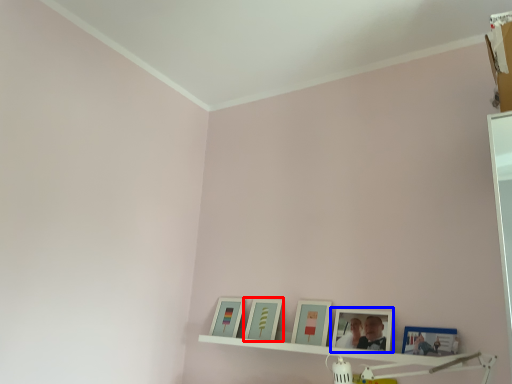
Question: Which point is closer to the camera, picture frame (highlighted by a red box) or picture frame (highlighted by a blue box)?

Choices:
 (A) picture frame
 (B) picture frame

Answer: (B)